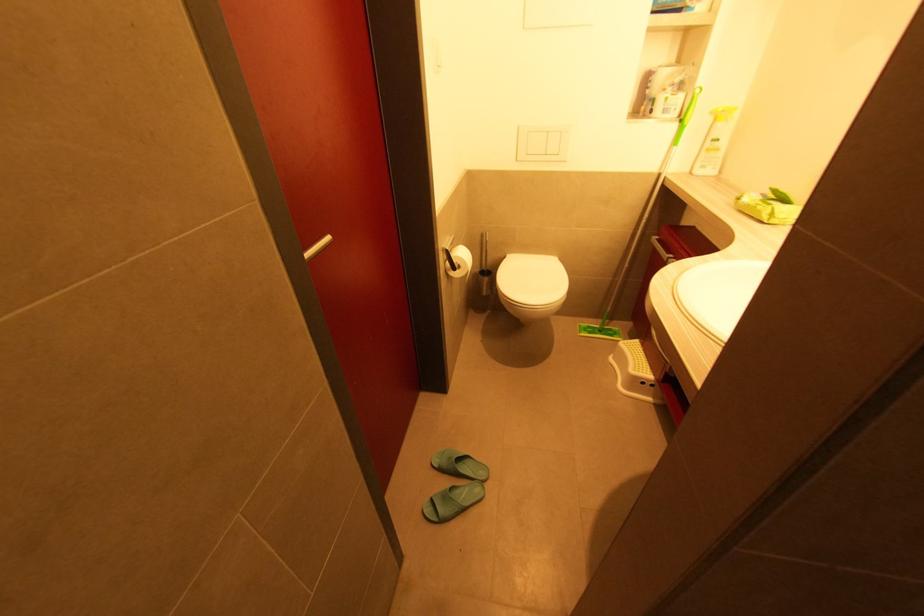
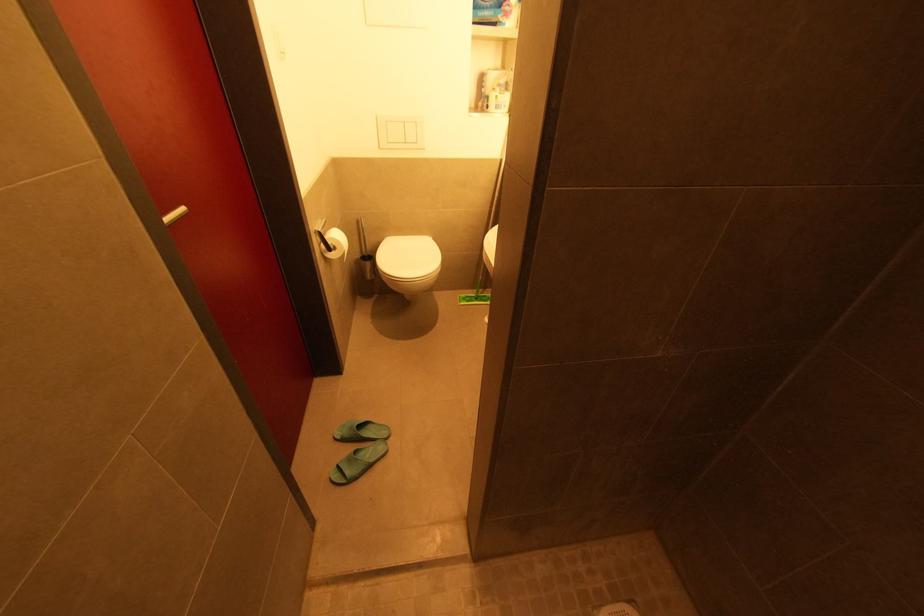
Question: The camera is either moving clockwise (left) or counter-clockwise (right) around the object. The first image is from the beginning of the video and the second image is from the end. Is the camera moving left or right when shooting the video?

Choices:
 (A) Left
 (B) Right

Answer: (A)